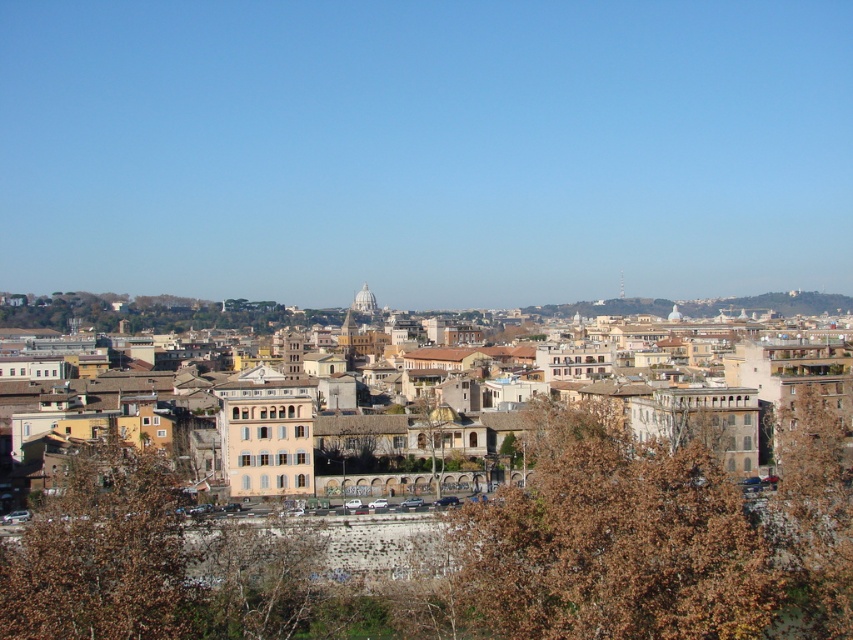
You are a city planner assessing the spacing between the brown leafy tree at lower center and the brown textured tree at center. Given that the minimum required distance for urban tree spacing is 30 meters, can the current spacing between them comply with the regulation?

The distance between the brown leafy tree at lower center and the brown textured tree at center is 34.53 meters, which exceeds the minimum required 30 meters. Therefore, the current spacing complies with the urban tree spacing regulation.

You are standing in the cityscape and want to take a photo of both the brown leafy tree at lower center and the brown leafy tree at lower left. Which tree should you position yourself to the right of to capture both in your frame?

You should position yourself to the right of the brown leafy tree at lower left because the brown leafy tree at lower center is already to the right of it, allowing both trees to be included in the frame.

You are standing in the cityscape and want to take a photo of both the brown leafy tree at lower center and the brown leafy tree at lower left. Which tree should you focus on first to ensure both are in the frame?

You should focus on the brown leafy tree at lower left first because it is shorter than the brown leafy tree at lower center, allowing you to position the taller tree in the background while keeping both within the camera frame.